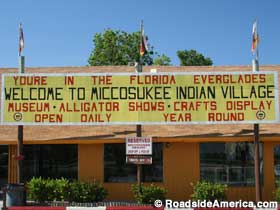
Locate an element on the screen. door is located at coordinates (5, 173).